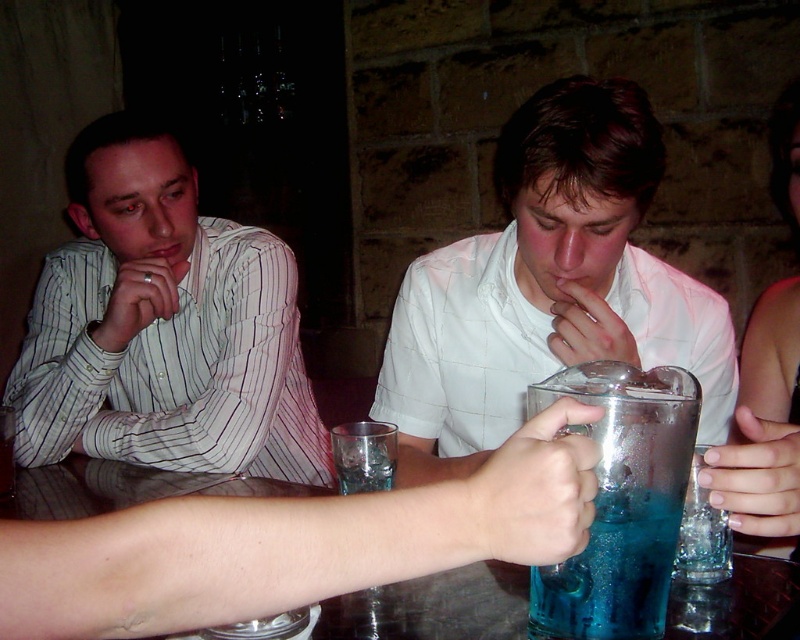
Who is taller, white striped shirt at left or blue translucent liquid at center?

With more height is white striped shirt at left.

Which is in front, point (136, 300) or point (584, 605)?

Point (584, 605)

Where is `white striped shirt at left`? white striped shirt at left is located at coordinates (162, 326).

Is white matte shirt at center smaller than blue translucent liquid at center?

Actually, white matte shirt at center might be larger than blue translucent liquid at center.

Who is taller, white matte shirt at center or blue translucent liquid at center?

white matte shirt at center

Image resolution: width=800 pixels, height=640 pixels. I want to click on white matte shirt at center, so click(548, 285).

Who is more distant from viewer, (162, 131) or (754, 620)?

Positioned behind is point (162, 131).

Does white striped shirt at left appear on the right side of transparent glass at center?

In fact, white striped shirt at left is to the left of transparent glass at center.

Identify the location of white striped shirt at left. The image size is (800, 640). (162, 326).

The width and height of the screenshot is (800, 640). I want to click on white striped shirt at left, so click(162, 326).